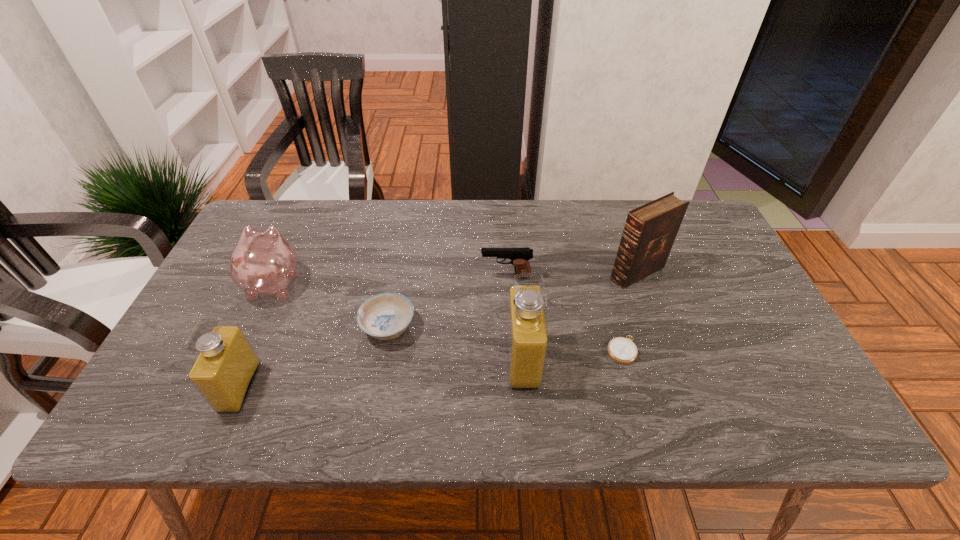
Image resolution: width=960 pixels, height=540 pixels. I want to click on free location located 0.130m on the front facing side of the piggy bank, so click(x=298, y=232).

This screenshot has width=960, height=540. I want to click on vacant area situated 0.350m on the back of the compass, so click(592, 244).

Locate an element on the screen. The height and width of the screenshot is (540, 960). compass located in the near edge section of the desktop is located at coordinates (622, 350).

Identify the location of object situated at the left edge. (262, 262).

What are the coordinates of `vacant space at the far edge of the desktop` in the screenshot? It's located at 540,242.

Locate an element on the screen. vacant area at the near edge is located at coordinates (276, 382).

Locate an element on the screen. free space at the far left corner is located at coordinates (286, 217).

In the image, there is a desktop. Where is `free space at the far right corner`? Image resolution: width=960 pixels, height=540 pixels. free space at the far right corner is located at coordinates (689, 236).

You are a GUI agent. You are given a task and a screenshot of the screen. Output one action in this format:
    pyautogui.click(x=<x>, y=<y>)
    Task: Click on the unoccupied position between the sixth tallest object and the fifth shortest object
    This screenshot has width=960, height=540.
    Given the screenshot: What is the action you would take?
    pyautogui.click(x=314, y=357)

Identify the location of empty location between the third tallest object and the taller perfume. (381, 374).